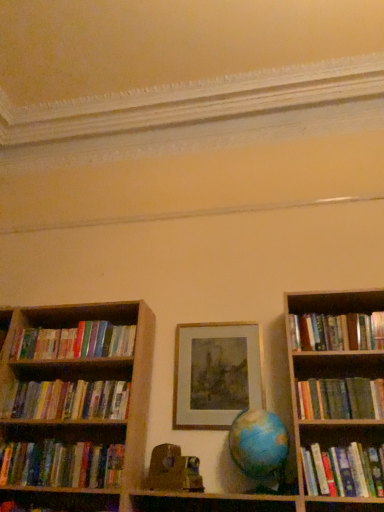
Question: Should I look upward or downward to see hardcover books at right, which ranks as the 3th book in bottom-to-top order?

Choices:
 (A) down
 (B) up

Answer: (A)

Question: Should I look upward or downward to see hardcover books at right, the first book in the top-to-bottom sequence?

Choices:
 (A) up
 (B) down

Answer: (B)

Question: Is wooden toy at center positioned with its back to hardcover books at right, which ranks as the fifth book in top-to-bottom order?

Choices:
 (A) no
 (B) yes

Answer: (A)

Question: Does wooden toy at center lie in front of hardcover books at right, which ranks as the 3th book in bottom-to-top order?

Choices:
 (A) no
 (B) yes

Answer: (A)

Question: Is wooden toy at center taller than hardcover books at right, which ranks as the 3th book in bottom-to-top order?

Choices:
 (A) yes
 (B) no

Answer: (B)

Question: Is wooden toy at center at the left side of hardcover books at right, which ranks as the fifth book in top-to-bottom order?

Choices:
 (A) no
 (B) yes

Answer: (B)

Question: From a real-world perspective, is wooden toy at center over hardcover books at right, which ranks as the 3th book in bottom-to-top order?

Choices:
 (A) yes
 (B) no

Answer: (B)

Question: From the image's perspective, would you say wooden toy at center is shown under hardcover books at right, which ranks as the fifth book in top-to-bottom order?

Choices:
 (A) yes
 (B) no

Answer: (A)

Question: Are hardcover books at right, which ranks as the fifth book in top-to-bottom order, and hardcover books at left, which is the fourth book in top-to-bottom order, beside each other?

Choices:
 (A) no
 (B) yes

Answer: (A)

Question: Is hardcover books at left, which is the fourth book in top-to-bottom order, located within hardcover books at right, which ranks as the 3th book in bottom-to-top order?

Choices:
 (A) yes
 (B) no

Answer: (B)

Question: Does hardcover books at right, which ranks as the 3th book in bottom-to-top order, have a lesser height compared to hardcover books at left, which is the fourth book in top-to-bottom order?

Choices:
 (A) yes
 (B) no

Answer: (B)

Question: Is hardcover books at right, which ranks as the 3th book in bottom-to-top order, not close to hardcover books at left, which is the fourth book in top-to-bottom order?

Choices:
 (A) yes
 (B) no

Answer: (A)

Question: Is hardcover books at right, which ranks as the 3th book in bottom-to-top order, turned away from hardcover books at left, which ranks as the 4th book in bottom-to-top order?

Choices:
 (A) no
 (B) yes

Answer: (A)

Question: From the image's perspective, would you say hardcover books at right, which ranks as the 3th book in bottom-to-top order, is positioned over hardcover books at left, which ranks as the 4th book in bottom-to-top order?

Choices:
 (A) no
 (B) yes

Answer: (A)

Question: Can you confirm if hardcover books at left, the sixth book in the top-to-bottom sequence, is taller than hardcover books at right, which is counted as the seventh book, starting from the bottom?

Choices:
 (A) no
 (B) yes

Answer: (B)